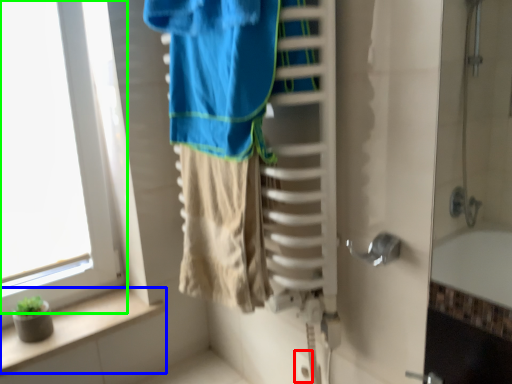
Question: Estimate the real-world distances between objects in this image. Which object is closer to electric outlet (highlighted by a red box), balustrade (highlighted by a blue box) or window (highlighted by a green box)?

Choices:
 (A) balustrade
 (B) window

Answer: (A)